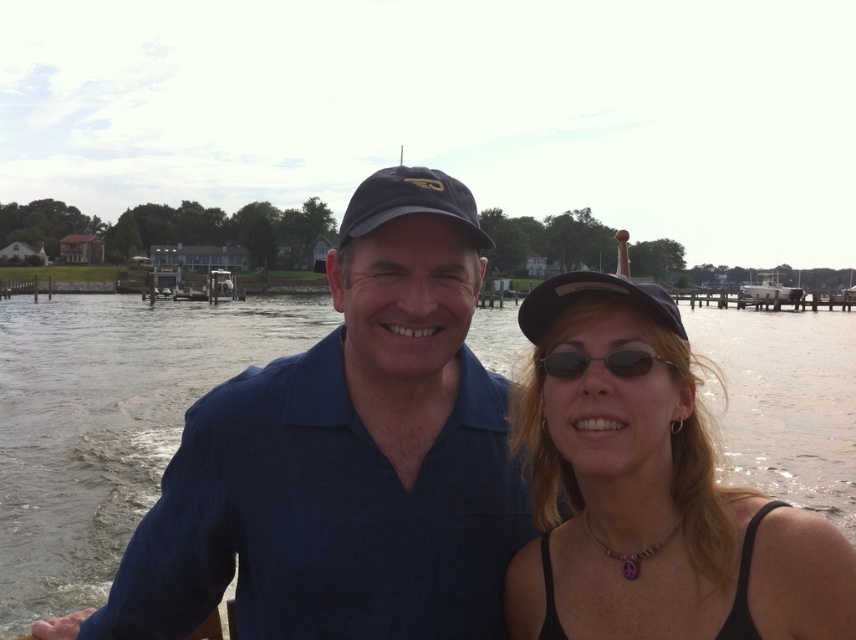
Can you confirm if clear water at center is positioned to the right of black plastic sunglasses at center?

Indeed, clear water at center is positioned on the right side of black plastic sunglasses at center.

Is clear water at center below black plastic sunglasses at center?

Incorrect, clear water at center is not positioned below black plastic sunglasses at center.

Who is more forward, (828, 352) or (568, 372)?

Point (568, 372) is in front.

Image resolution: width=856 pixels, height=640 pixels. In order to click on clear water at center in this screenshot , I will do `click(107, 422)`.

Is clear water at center positioned before black fabric tank top at center?

No, it is behind black fabric tank top at center.

Does point (54, 321) lie behind point (752, 586)?

Yes.

Measure the distance between point (99, 390) and camera.

Point (99, 390) and camera are 27.99 meters apart from each other.

Find the location of a particular element. The height and width of the screenshot is (640, 856). clear water at center is located at coordinates (107, 422).

Is clear water at center positioned before matte black baseball cap at center?

No, clear water at center is further to the viewer.

Is clear water at center to the left of matte black baseball cap at center from the viewer's perspective?

Incorrect, clear water at center is not on the left side of matte black baseball cap at center.

Does point (834, 314) lie behind point (351, 198)?

That is True.

This screenshot has width=856, height=640. What are the coordinates of `clear water at center` in the screenshot? It's located at (107, 422).